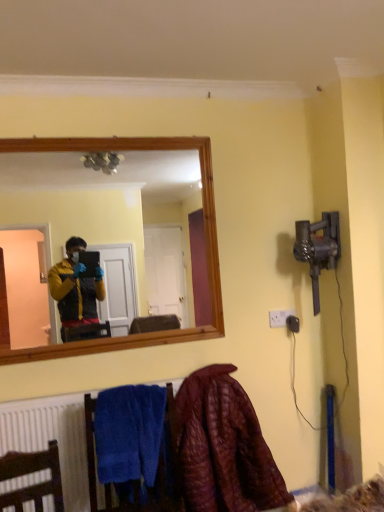
Question: Is white plastic electric outlet at lower right not close to blue soft towel at lower left?

Choices:
 (A) no
 (B) yes

Answer: (A)

Question: Is white plastic electric outlet at lower right taller than blue soft towel at lower left?

Choices:
 (A) yes
 (B) no

Answer: (B)

Question: Is white plastic electric outlet at lower right shorter than blue soft towel at lower left?

Choices:
 (A) no
 (B) yes

Answer: (B)

Question: Is the depth of white plastic electric outlet at lower right less than that of blue soft towel at lower left?

Choices:
 (A) no
 (B) yes

Answer: (A)

Question: Is white plastic electric outlet at lower right next to blue soft towel at lower left?

Choices:
 (A) no
 (B) yes

Answer: (A)

Question: Is blue soft towel at lower left located within white plastic electric outlet at lower right?

Choices:
 (A) yes
 (B) no

Answer: (B)

Question: Considering the relative sizes of velvet maroon blanket at lower right and blue soft towel at lower left in the image provided, is velvet maroon blanket at lower right wider than blue soft towel at lower left?

Choices:
 (A) no
 (B) yes

Answer: (B)

Question: From a real-world perspective, is velvet maroon blanket at lower right located higher than blue soft towel at lower left?

Choices:
 (A) yes
 (B) no

Answer: (B)

Question: Is there a large distance between velvet maroon blanket at lower right and blue soft towel at lower left?

Choices:
 (A) yes
 (B) no

Answer: (B)

Question: Does velvet maroon blanket at lower right appear on the right side of blue soft towel at lower left?

Choices:
 (A) no
 (B) yes

Answer: (B)

Question: From the image's perspective, does velvet maroon blanket at lower right appear higher than blue soft towel at lower left?

Choices:
 (A) yes
 (B) no

Answer: (B)

Question: From the image's perspective, is velvet maroon blanket at lower right under blue soft towel at lower left?

Choices:
 (A) no
 (B) yes

Answer: (B)

Question: Considering the relative sizes of velvet maroon blanket at lower right and white plastic electric outlet at lower right in the image provided, is velvet maroon blanket at lower right taller than white plastic electric outlet at lower right?

Choices:
 (A) no
 (B) yes

Answer: (B)